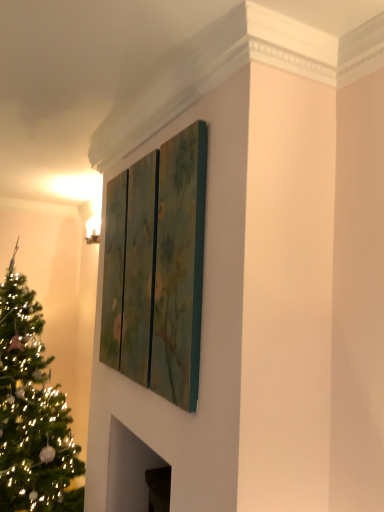
Question: Is shiny green christmas tree at left inside the boundaries of textured green triptych at upper center, or outside?

Choices:
 (A) outside
 (B) inside

Answer: (A)

Question: Does point (48, 434) appear closer or farther from the camera than point (152, 175)?

Choices:
 (A) farther
 (B) closer

Answer: (A)

Question: Considering their positions, is shiny green christmas tree at left located in front of or behind textured green triptych at upper center?

Choices:
 (A) behind
 (B) front

Answer: (A)

Question: From their relative heights in the image, would you say textured green triptych at upper center is taller or shorter than shiny green christmas tree at left?

Choices:
 (A) short
 (B) tall

Answer: (A)

Question: Is textured green triptych at upper center inside or outside of shiny green christmas tree at left?

Choices:
 (A) outside
 (B) inside

Answer: (A)

Question: Is textured green triptych at upper center in front of or behind shiny green christmas tree at left in the image?

Choices:
 (A) behind
 (B) front

Answer: (B)

Question: From the image's perspective, relative to shiny green christmas tree at left, is textured green triptych at upper center above or below?

Choices:
 (A) above
 (B) below

Answer: (A)